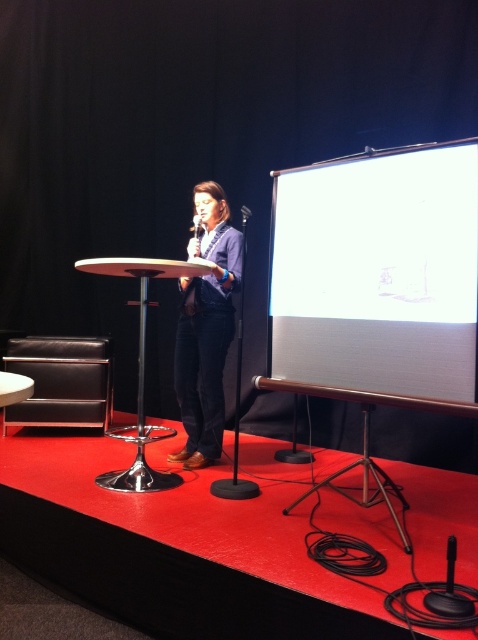
You are organizing a presentation and need to ensure the white matte projection screen at right is visible to all attendees. Considering the denim jacket at center is worn by the presenter, will the screen be obstructed by the presenter?

The white matte projection screen at right is shorter than the denim jacket at center, so the presenter wearing the denim jacket at center may block the screen if they stand in front of it. Adjust the screen position or presenter stance to avoid obstruction.

Looking at this image, you are organizing a presentation and need to place a decorative stand between the denim jacket at center and the black plastic microphone at center. Which object should the stand be placed closer to if it needs to be positioned at the same height as the taller object?

The stand should be placed closer to the denim jacket at center because it is taller than the black plastic microphone at center.

You are organizing a presentation and need to place a name tag on the table. The name tag is the same size as the black plastic microphone at center. Will the denim jacket at center block the name tag from being fully visible?

The denim jacket at center has a larger size compared to the black plastic microphone at center. Since the name tag is the same size as the microphone, the larger denim jacket may block part of the name tag, making it less visible.